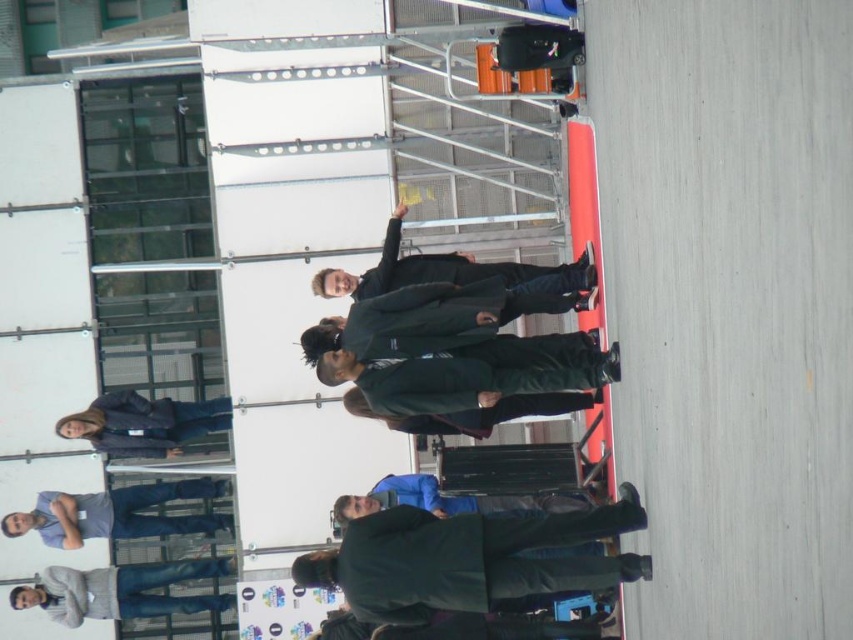
Question: Does green matte jacket at center appear on the left side of dark green coat at center?

Choices:
 (A) yes
 (B) no

Answer: (B)

Question: Is the position of dark green coat at center more distant than that of dark blue jacket at lower left?

Choices:
 (A) yes
 (B) no

Answer: (B)

Question: Among these points, which one is nearest to the camera?

Choices:
 (A) (540, 516)
 (B) (184, 428)
 (C) (601, 360)
 (D) (231, 596)

Answer: (C)

Question: Which of the following is the closest to the observer?

Choices:
 (A) dark green fabric business suit at center
 (B) blue denim jeans at lower left
 (C) gray sweater at lower left

Answer: (A)

Question: Is dark green fabric business suit at center closer to the viewer compared to dark green coat at center?

Choices:
 (A) yes
 (B) no

Answer: (A)

Question: Which point appears farthest from the camera in this image?

Choices:
 (A) (532, 268)
 (B) (538, 412)
 (C) (115, 424)

Answer: (C)